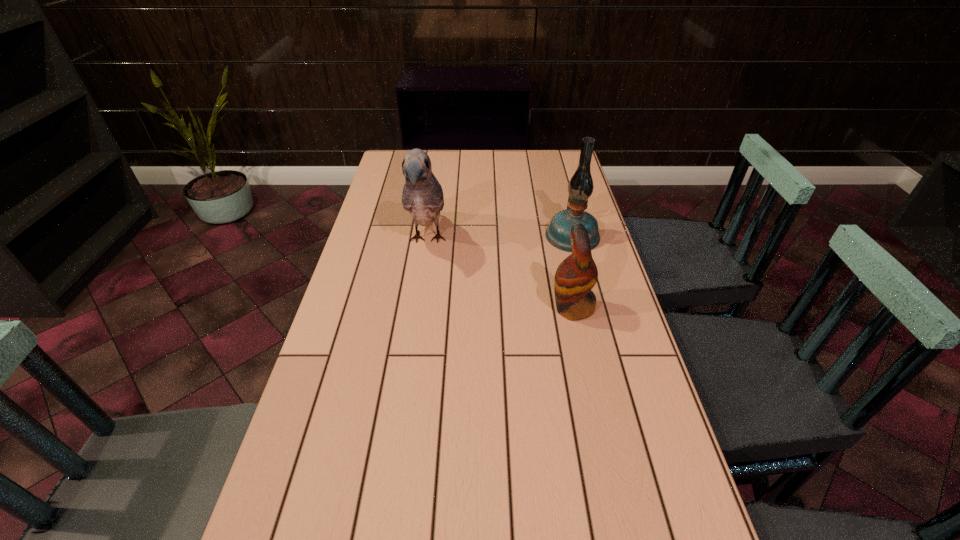
The image size is (960, 540). Identify the location of the farther parrot. (422, 196).

This screenshot has height=540, width=960. In order to click on the leftmost object in this screenshot , I will do `click(422, 196)`.

Where is `oil lamp`? The image size is (960, 540). oil lamp is located at coordinates (580, 187).

What are the coordinates of `the shorter parrot` in the screenshot? It's located at [576, 275].

This screenshot has height=540, width=960. I want to click on the shortest object, so click(x=576, y=275).

You are a GUI agent. You are given a task and a screenshot of the screen. Output one action in this format:
    pyautogui.click(x=<x>, y=<y>)
    Task: Click on the free space located on the front-facing side of the leftmost object
    
    Given the screenshot: What is the action you would take?
    pos(410,360)

You are a GUI agent. You are given a task and a screenshot of the screen. Output one action in this format:
    pyautogui.click(x=<x>, y=<y>)
    Task: Click on the vacant space located on the back of the oil lamp
    This screenshot has width=960, height=540.
    Given the screenshot: What is the action you would take?
    pyautogui.click(x=559, y=184)

Locate an element on the screen. vacant space located on the face of the nearest object is located at coordinates (444, 308).

I want to click on blank space located on the face of the nearest object, so click(403, 308).

Identify the location of free region located 0.300m on the face of the nearest object. click(440, 308).